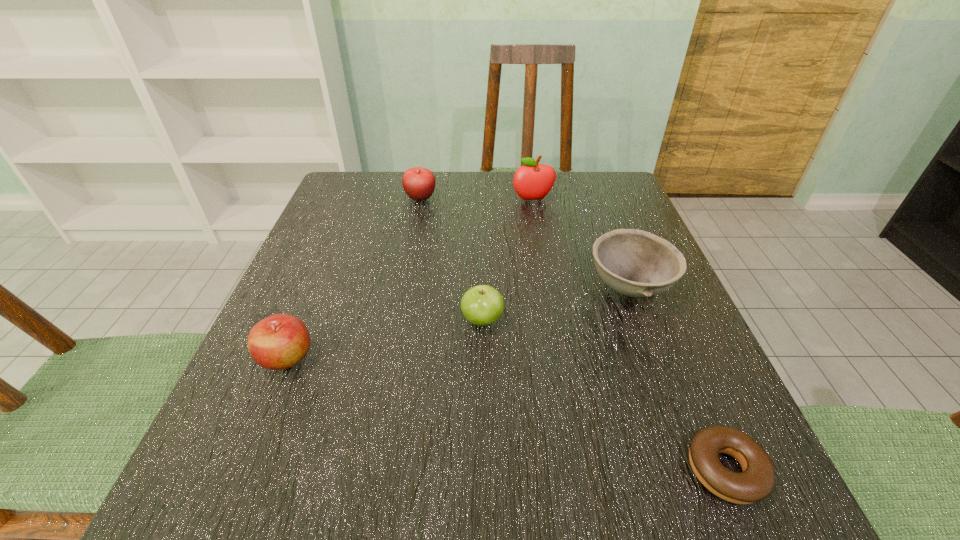
Choose which apple is the nearest neighbor to the rightmost apple. Please provide its 2D coordinates. Your answer should be formatted as a tuple, i.e. [(x, y)], where the tuple contains the x and y coordinates of a point satisfying the conditions above.

[(419, 183)]

This screenshot has height=540, width=960. What are the coordinates of `free location that satisfies the following two spatial constraints: 1. on the front side of the nearest object; 2. on the right side of the third farthest apple` in the screenshot? It's located at (483, 470).

Where is `free spot that satisfies the following two spatial constraints: 1. on the front side of the second apple from right to left; 2. on the left side of the nearest object`? free spot that satisfies the following two spatial constraints: 1. on the front side of the second apple from right to left; 2. on the left side of the nearest object is located at coordinates (483, 470).

Find the location of `blank area in the image that satisfies the following two spatial constraints: 1. on the front side of the bowl; 2. on the right side of the shortest object`. blank area in the image that satisfies the following two spatial constraints: 1. on the front side of the bowl; 2. on the right side of the shortest object is located at coordinates (699, 470).

The height and width of the screenshot is (540, 960). Find the location of `vacant area that satisfies the following two spatial constraints: 1. on the back side of the tallest object; 2. on the left side of the leftmost object`. vacant area that satisfies the following two spatial constraints: 1. on the back side of the tallest object; 2. on the left side of the leftmost object is located at coordinates (353, 200).